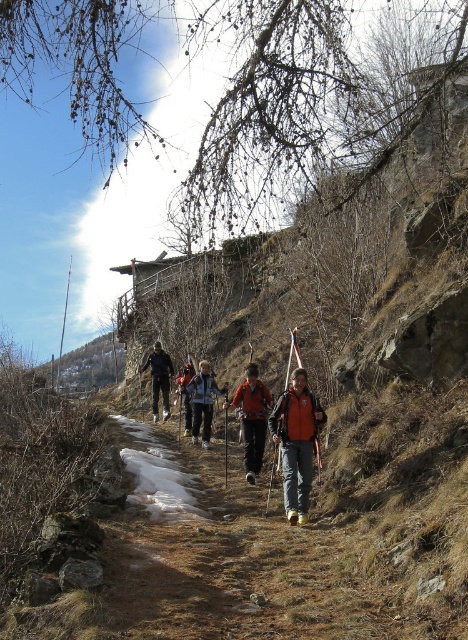
Question: Which point is farther to the camera?

Choices:
 (A) brown dirt path at center
 (B) black fabric jacket at center
 (C) orange fabric jacket at center
 (D) orange softshell jacket at center

Answer: (B)

Question: Is brown dirt path at center further to the viewer compared to orange fabric jacket at center?

Choices:
 (A) yes
 (B) no

Answer: (B)

Question: Does orange fleece jacket at center have a lesser width compared to black fabric jacket at center?

Choices:
 (A) no
 (B) yes

Answer: (B)

Question: Is orange softshell jacket at center closer to the viewer compared to orange fleece jacket at center?

Choices:
 (A) no
 (B) yes

Answer: (B)

Question: Which point appears farthest from the camera in this image?

Choices:
 (A) (183, 422)
 (B) (212, 392)
 (C) (167, 365)
 (D) (194, 499)

Answer: (C)

Question: Considering the real-world distances, which object is closest to the orange softshell jacket at center?

Choices:
 (A) orange fleece jacket at center
 (B) orange fabric jacket at center

Answer: (A)